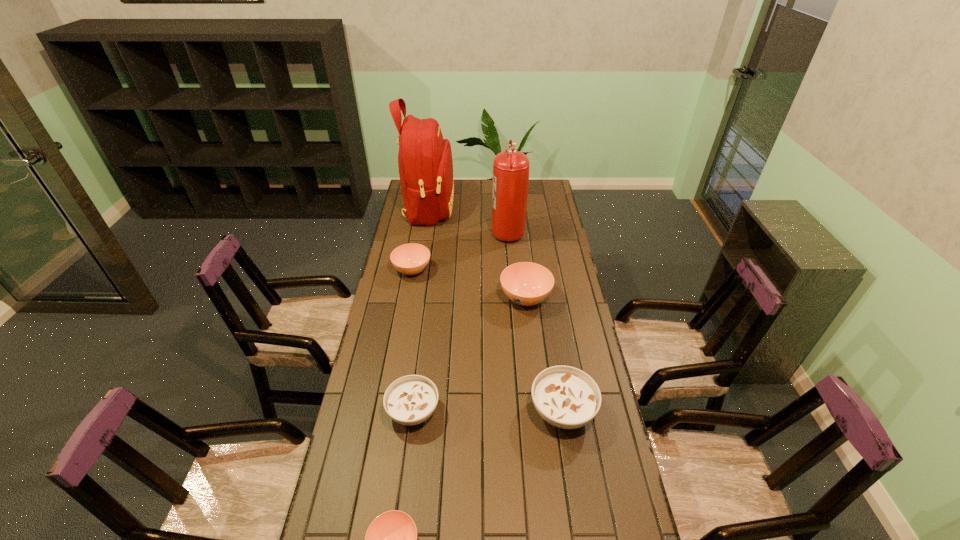
The width and height of the screenshot is (960, 540). I want to click on blank space located on the left of the rightmost peach soup bowl, so click(x=480, y=298).

Where is `vacant space located 0.190m on the front of the bigger white soup bowl`? Image resolution: width=960 pixels, height=540 pixels. vacant space located 0.190m on the front of the bigger white soup bowl is located at coordinates (578, 509).

Identify the location of vacant region located on the back of the second smallest peach soup bowl. This screenshot has width=960, height=540. (420, 231).

Where is `vacant space located 0.260m on the front of the left white soup bowl`? The height and width of the screenshot is (540, 960). vacant space located 0.260m on the front of the left white soup bowl is located at coordinates (398, 529).

In order to click on object at the far edge in this screenshot , I will do `click(425, 163)`.

Identify the location of backpack positioned at the left edge. (425, 163).

At what (x,y) coordinates should I click in order to perform the action: click on object present at the far left corner. Please return your answer as a coordinate pair (x, y). The height and width of the screenshot is (540, 960). Looking at the image, I should click on (425, 163).

This screenshot has height=540, width=960. I want to click on vacant point at the left edge, so click(348, 520).

Where is `vacant area at the right edge of the desktop`? The width and height of the screenshot is (960, 540). vacant area at the right edge of the desktop is located at coordinates 543,213.

Locate an element on the screen. Image resolution: width=960 pixels, height=540 pixels. free space at the far right corner of the desktop is located at coordinates (528, 202).